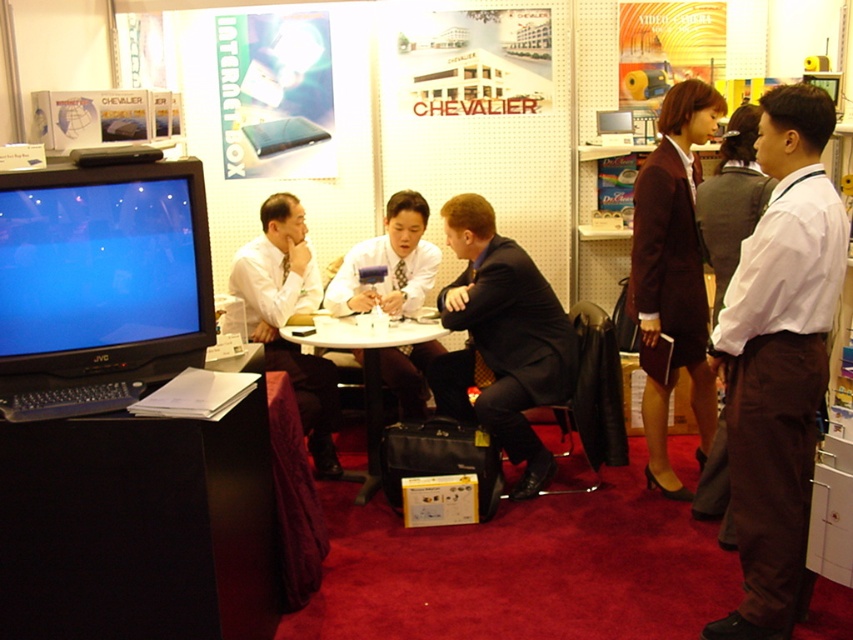
Which is below, maroon fabric dress at right or white glossy tie at center?

Positioned lower is maroon fabric dress at right.

Which is more to the left, maroon fabric dress at right or white glossy tie at center?

white glossy tie at center is more to the left.

Who is more forward, [674,481] or [401,413]?

Point [674,481] is in front.

Locate an element on the screen. The width and height of the screenshot is (853, 640). maroon fabric dress at right is located at coordinates (672, 273).

Is white glossy tie at center above white plastic table at center?

Yes.

Based on the photo, is white glossy tie at center wider than white plastic table at center?

No, white glossy tie at center is not wider than white plastic table at center.

Describe the element at coordinates (389, 262) in the screenshot. I see `white glossy tie at center` at that location.

Locate an element on the screen. The height and width of the screenshot is (640, 853). white glossy tie at center is located at coordinates (x=389, y=262).

Is point (28, 412) farther from viewer compared to point (397, 285)?

No, (28, 412) is closer to viewer.

Who is taller, black glossy monitor at left or white glossy tie at center?

black glossy monitor at left

Is point (0, 209) farther from viewer compared to point (410, 225)?

No.

The image size is (853, 640). Identify the location of black glossy monitor at left. [x=100, y=285].